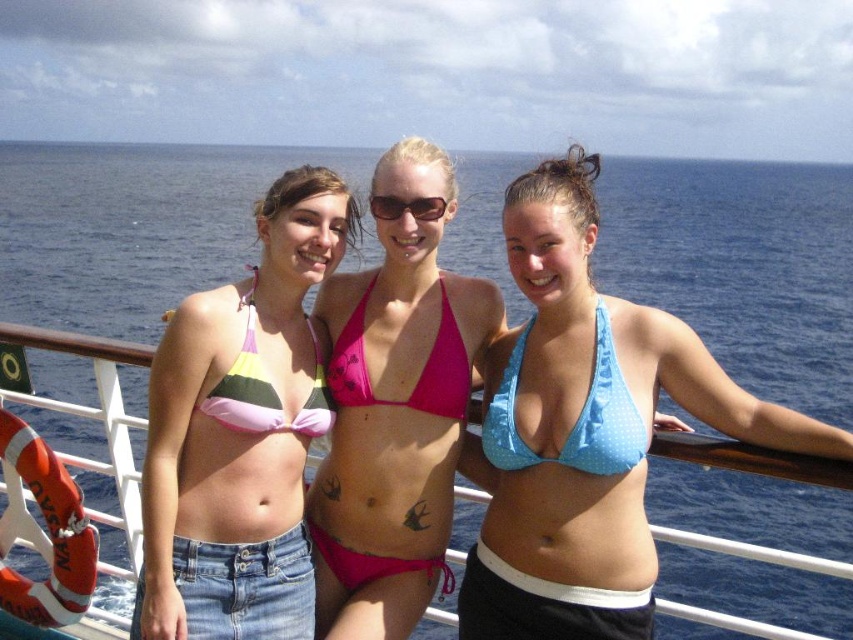
You are a photographer trying to capture a group photo of the striped bikini top at center and the striped fabric bikini top at center. Since both have similar patterns, you need to distinguish them by their width. Which one should you focus on to ensure clarity?

The striped bikini top at center is wider than the striped fabric bikini top at center, so focusing on the wider one would help distinguish them.

You are a photographer on the deck of the ship trying to capture a photo of the pink fabric bikini at center without the metallic silver boat at center appearing in the background. Is this possible based on their positions?

The metallic silver boat at center is behind the pink fabric bikini at center, so yes, you can take a photo of the pink fabric bikini at center without the boat appearing in the background by positioning the camera in front of the bikini, ensuring the boat is out of the frame.

You are a photographer trying to capture a candid shot of the striped bikini top at center and the pink fabric bikini at center. Since you want to ensure both are fully visible in the frame, which of the two should you focus on first to avoid cropping the bottom part?

The striped bikini top at center is shorter than the pink fabric bikini at center, so you should focus on ensuring the pink fabric bikini at center is fully visible first to avoid cropping its bottom part.